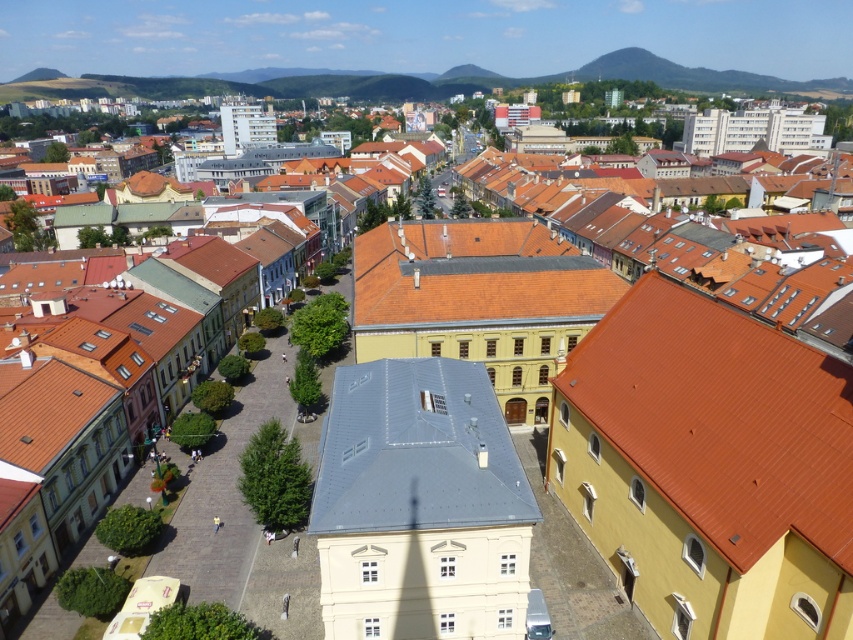
You are standing in the central square and want to take a photo that includes both the gray slate roof at center and the orange tile roof at center. Which direction should you face to ensure both are visible in your camera frame?

You should face to the right to include both the gray slate roof at center and the orange tile roof at center in your camera frame, since the gray slate roof at center is located to the left of the orange tile roof at center.

You are a drone operator flying over the town. You need to deliver a package to the gray slate roof at center. However, there is an orange tile roof at center right in the way. Can you safely navigate your drone between them?

The orange tile roof at center right is located above the gray slate roof at center, so the drone can safely navigate between them as there is vertical clearance available.